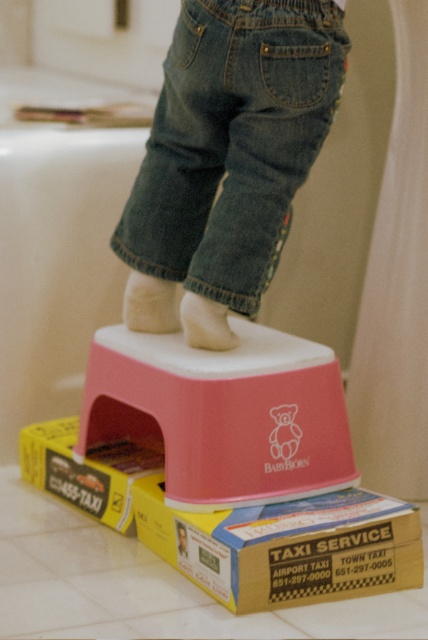
Question: Observing the image, what is the correct spatial positioning of pink plastic step stool at center in reference to yellow cardboard box at lower center?

Choices:
 (A) below
 (B) above

Answer: (B)

Question: Which of the following is the farthest from the observer?

Choices:
 (A) (190, 305)
 (B) (140, 460)

Answer: (B)

Question: Which object is closer to the camera taking this photo?

Choices:
 (A) yellow cardboard box at lower left
 (B) white fuzzy foot at center
 (C) white sock at upper center
 (D) pink plastic step stool at center

Answer: (D)

Question: Which object is the farthest from the yellow cardboard box at lower left?

Choices:
 (A) yellow cardboard box at lower center
 (B) white fuzzy foot at center

Answer: (B)

Question: Does pink plastic step stool at center have a larger size compared to white sock at upper center?

Choices:
 (A) yes
 (B) no

Answer: (A)

Question: Does yellow cardboard box at lower center have a lesser width compared to white fuzzy foot at center?

Choices:
 (A) yes
 (B) no

Answer: (B)